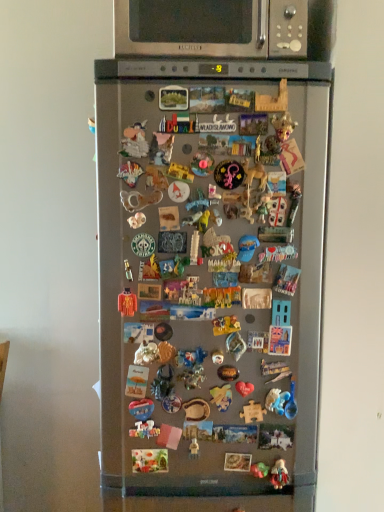
Image resolution: width=384 pixels, height=512 pixels. What do you see at coordinates (127, 303) in the screenshot?
I see `orange fabric toy at center, the 4th toy viewed from the right` at bounding box center [127, 303].

The image size is (384, 512). I want to click on matte plastic figurine at lower center, which is counted as the 1th toy, starting from the bottom, so click(279, 474).

What do you see at coordinates (210, 271) in the screenshot? The height and width of the screenshot is (512, 384). I see `satin silver fridge at center` at bounding box center [210, 271].

Identify the location of orange fabric toy at center, arranged as the 4th toy when ordered from the bottom. (127, 303).

Does point (121, 298) appear closer or farther from the camera than point (193, 439)?

Point (121, 298) is positioned closer to the camera compared to point (193, 439).

Can you confirm if orange fabric toy at center, arranged as the 4th toy when ordered from the bottom, is positioned to the right of metallic gold figurine at center, which is counted as the second toy, starting from the left?

No, orange fabric toy at center, arranged as the 4th toy when ordered from the bottom, is not to the right of metallic gold figurine at center, which is counted as the second toy, starting from the left.

From the image's perspective, does orange fabric toy at center, which is counted as the first toy, starting from the left, appear lower than metallic gold figurine at center, the 3th toy when ordered from right to left?

No.

How much distance is there between orange fabric toy at center, arranged as the 4th toy when ordered from the bottom, and satin silver microwave at upper center?

The distance of orange fabric toy at center, arranged as the 4th toy when ordered from the bottom, from satin silver microwave at upper center is 28.93 inches.

Are orange fabric toy at center, which is counted as the first toy, starting from the left, and satin silver microwave at upper center located far from each other?

orange fabric toy at center, which is counted as the first toy, starting from the left, is near satin silver microwave at upper center, not far away.

From the image's perspective, is orange fabric toy at center, which is counted as the first toy, starting from the left, on satin silver microwave at upper center?

No, from the image's perspective, orange fabric toy at center, which is counted as the first toy, starting from the left, is not above satin silver microwave at upper center.

Considering the positions of objects orange fabric toy at center, arranged as the 4th toy when ordered from the bottom, and satin silver microwave at upper center in the image provided, who is more to the left, orange fabric toy at center, arranged as the 4th toy when ordered from the bottom, or satin silver microwave at upper center?

Positioned to the left is orange fabric toy at center, arranged as the 4th toy when ordered from the bottom.

Considering the sizes of objects satin silver microwave at upper center and metallic gold figurine at center, the 3th toy when ordered from right to left, in the image provided, who is thinner, satin silver microwave at upper center or metallic gold figurine at center, the 3th toy when ordered from right to left,?

With smaller width is metallic gold figurine at center, the 3th toy when ordered from right to left.

Image resolution: width=384 pixels, height=512 pixels. In order to click on microwave oven that appears above the metallic gold figurine at center, the 3th toy when ordered from top to bottom (from the image's perspective) in this screenshot , I will do `click(211, 28)`.

Does satin silver microwave at upper center have a smaller size compared to metallic gold figurine at center, which is counted as the second toy, starting from the left?

No, satin silver microwave at upper center is not smaller than metallic gold figurine at center, which is counted as the second toy, starting from the left.

From the image's perspective, is satin silver microwave at upper center positioned above or below metallic gold figurine at center, the 3th toy when ordered from right to left?

Based on their image positions, satin silver microwave at upper center is located above metallic gold figurine at center, the 3th toy when ordered from right to left.

In terms of size, does matte plastic figurine at lower center, which is counted as the 1th toy, starting from the bottom, appear bigger or smaller than metallic gold figurine at center, the 2th toy in the bottom-to-top sequence?

Clearly, matte plastic figurine at lower center, which is counted as the 1th toy, starting from the bottom, is larger in size than metallic gold figurine at center, the 2th toy in the bottom-to-top sequence.

From the matte plastic figurine at lower center, arranged as the first toy when viewed from the right, count the 2nd toy to the left and point to it. Please provide its 2D coordinates.

[(194, 448)]

Can you tell me how much matte plastic figurine at lower center, which is counted as the 1th toy, starting from the bottom, and metallic gold figurine at center, which is counted as the second toy, starting from the left, differ in facing direction?

There is a 0.00723-degree angle between the facing directions of matte plastic figurine at lower center, which is counted as the 1th toy, starting from the bottom, and metallic gold figurine at center, which is counted as the second toy, starting from the left.

What's the angular difference between orange fabric toy at center, arranged as the 4th toy when ordered from the bottom, and matte plastic figurine at lower center, the 4th toy from the top,'s facing directions?

0.0114 degrees separate the facing orientations of orange fabric toy at center, arranged as the 4th toy when ordered from the bottom, and matte plastic figurine at lower center, the 4th toy from the top.

Is orange fabric toy at center, the 4th toy viewed from the right, positioned behind matte plastic figurine at lower center, the 4th toy when ordered from left to right?

No.

Considering the positions of point (129, 296) and point (288, 481), is point (129, 296) closer or farther from the camera than point (288, 481)?

Point (129, 296).

Relative to satin silver fridge at center, is orange fabric toy at center, which is counted as the first toy, starting from the left, in front or behind?

orange fabric toy at center, which is counted as the first toy, starting from the left, is behind satin silver fridge at center.

From a real-world perspective, which is physically below, orange fabric toy at center, arranged as the 4th toy when ordered from the bottom, or satin silver fridge at center?

satin silver fridge at center is physically lower.

In the image, there is a satin silver fridge at center. Where is `toy above it (from the image's perspective)`? This screenshot has width=384, height=512. toy above it (from the image's perspective) is located at coordinates (127, 303).

Does orange fabric toy at center, which ranks as the first toy in top-to-bottom order, appear on the left side of satin silver fridge at center?

Yes, orange fabric toy at center, which ranks as the first toy in top-to-bottom order, is to the left of satin silver fridge at center.

You are a GUI agent. You are given a task and a screenshot of the screen. Output one action in this format:
    pyautogui.click(x=<x>, y=<y>)
    Task: Click on the 1st toy above the metallic gold figurine at center, the 2th toy in the bottom-to-top sequence (from the image's perspective)
    Image resolution: width=384 pixels, height=512 pixels.
    Given the screenshot: What is the action you would take?
    pyautogui.click(x=252, y=412)

Can you confirm if wooden puzzle piece at center, the 2th toy from the top, is positioned to the right of metallic gold figurine at center, the 3th toy when ordered from right to left?

Indeed, wooden puzzle piece at center, the 2th toy from the top, is positioned on the right side of metallic gold figurine at center, the 3th toy when ordered from right to left.

Is wooden puzzle piece at center, the 3th toy ordered from the bottom, further to the viewer compared to metallic gold figurine at center, the 2th toy in the bottom-to-top sequence?

That is True.

Based on the photo, which of these two, wooden puzzle piece at center, the 2th toy from the top, or metallic gold figurine at center, the 3th toy when ordered from right to left, is wider?

With larger width is metallic gold figurine at center, the 3th toy when ordered from right to left.

From a real-world perspective, starting from the metallic gold figurine at center, the 3th toy when ordered from right to left, which toy is the 2nd one vertically above it? Please provide its 2D coordinates.

[(127, 303)]

This screenshot has width=384, height=512. Identify the location of the 1st toy directly beneath the satin silver microwave at upper center (from a real-world perspective). (127, 303).

When comparing their distances from wooden puzzle piece at center, the 2th toy from the top, does satin silver microwave at upper center or matte plastic figurine at lower center, which is counted as the 1th toy, starting from the bottom, seem closer?

matte plastic figurine at lower center, which is counted as the 1th toy, starting from the bottom, is positioned closer to the anchor wooden puzzle piece at center, the 2th toy from the top.

When comparing their distances from metallic gold figurine at center, the 3th toy when ordered from top to bottom, does satin silver microwave at upper center or matte plastic figurine at lower center, which is counted as the 1th toy, starting from the bottom, seem further?

satin silver microwave at upper center.

Based on the photo, estimate the real-world distances between objects in this image. Which object is further from matte plastic figurine at lower center, the 4th toy when ordered from left to right, orange fabric toy at center, which ranks as the first toy in top-to-bottom order, or satin silver microwave at upper center?

Based on the image, satin silver microwave at upper center appears to be further to matte plastic figurine at lower center, the 4th toy when ordered from left to right.

Looking at this image, when comparing their distances from orange fabric toy at center, which is counted as the first toy, starting from the left, does satin silver microwave at upper center or matte plastic figurine at lower center, arranged as the first toy when viewed from the right, seem further?

satin silver microwave at upper center is positioned further to the anchor orange fabric toy at center, which is counted as the first toy, starting from the left.

Based on their spatial positions, is wooden puzzle piece at center, the second toy when ordered from right to left, or matte plastic figurine at lower center, the 4th toy when ordered from left to right, closer to metallic gold figurine at center, which is counted as the second toy, starting from the left?

Based on the image, wooden puzzle piece at center, the second toy when ordered from right to left, appears to be nearer to metallic gold figurine at center, which is counted as the second toy, starting from the left.

Based on their spatial positions, is satin silver microwave at upper center or metallic gold figurine at center, which is counted as the second toy, starting from the left, further from orange fabric toy at center, arranged as the 4th toy when ordered from the bottom?

satin silver microwave at upper center.

Based on their spatial positions, is matte plastic figurine at lower center, arranged as the first toy when viewed from the right, or orange fabric toy at center, arranged as the 4th toy when ordered from the bottom, further from satin silver microwave at upper center?

The object further to satin silver microwave at upper center is matte plastic figurine at lower center, arranged as the first toy when viewed from the right.

Estimate the real-world distances between objects in this image. Which object is further from matte plastic figurine at lower center, which is counted as the 1th toy, starting from the bottom, satin silver microwave at upper center or metallic gold figurine at center, the 2th toy in the bottom-to-top sequence?

The object further to matte plastic figurine at lower center, which is counted as the 1th toy, starting from the bottom, is satin silver microwave at upper center.

Find the location of a particular element. Image resolution: width=384 pixels, height=512 pixels. toy that lies between orange fabric toy at center, which ranks as the first toy in top-to-bottom order, and metallic gold figurine at center, the 2th toy in the bottom-to-top sequence, from top to bottom is located at coordinates (252, 412).

The height and width of the screenshot is (512, 384). Find the location of `toy between satin silver microwave at upper center and satin silver fridge at center vertically`. toy between satin silver microwave at upper center and satin silver fridge at center vertically is located at coordinates (127, 303).

The height and width of the screenshot is (512, 384). Identify the location of refrigerator between satin silver microwave at upper center and metallic gold figurine at center, the 3th toy when ordered from right to left, from top to bottom. (210, 271).

I want to click on toy between metallic gold figurine at center, which is counted as the second toy, starting from the left, and matte plastic figurine at lower center, which is counted as the 1th toy, starting from the bottom, in the horizontal direction, so click(x=252, y=412).